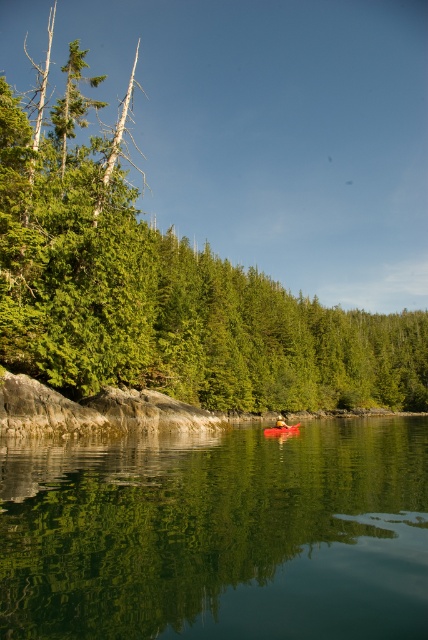
Which is more to the right, green smooth water at lower center or yellow fabric person at center?

Positioned to the right is yellow fabric person at center.

Can you confirm if green smooth water at lower center is positioned above yellow fabric person at center?

Correct, green smooth water at lower center is located above yellow fabric person at center.

Between point (23, 611) and point (279, 417), which one is positioned behind?

The point (279, 417) is behind.

Where is `green smooth water at lower center`? Image resolution: width=428 pixels, height=640 pixels. green smooth water at lower center is located at coordinates (219, 536).

Which is in front, point (272, 566) or point (278, 432)?

Point (272, 566) is in front.

What do you see at coordinates (219, 536) in the screenshot?
I see `green smooth water at lower center` at bounding box center [219, 536].

Identify the location of green smooth water at lower center. (219, 536).

The image size is (428, 640). Identify the location of green smooth water at lower center. (219, 536).

Does point (187, 365) come farther from viewer compared to point (279, 428)?

Yes.

Does green leafy tree at center have a smaller size compared to yellow fabric person at center?

Actually, green leafy tree at center might be larger than yellow fabric person at center.

Who is more distant from viewer, [397,276] or [276,422]?

Point [397,276]

Where is `green leafy tree at center`? green leafy tree at center is located at coordinates (222, 205).